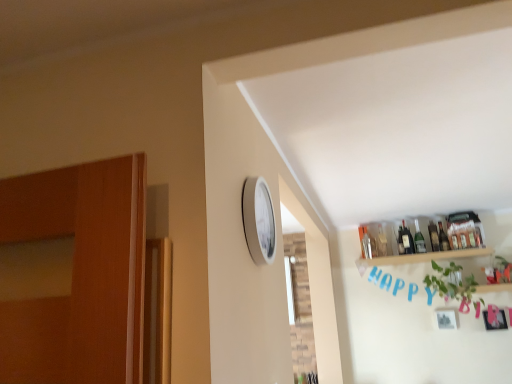
Question: Is translucent glass bottle at upper right, the 1th bottle in the left-to-right sequence, to the left of green leafy plant at upper right from the viewer's perspective?

Choices:
 (A) no
 (B) yes

Answer: (B)

Question: From a real-world perspective, is translucent glass bottle at upper right, which ranks as the 4th bottle in right-to-left order, below green leafy plant at upper right?

Choices:
 (A) yes
 (B) no

Answer: (B)

Question: Is green leafy plant at upper right a part of translucent glass bottle at upper right, which ranks as the 4th bottle in right-to-left order?

Choices:
 (A) no
 (B) yes

Answer: (A)

Question: Is the depth of translucent glass bottle at upper right, which ranks as the 4th bottle in right-to-left order, greater than that of green leafy plant at upper right?

Choices:
 (A) yes
 (B) no

Answer: (A)

Question: From the image's perspective, would you say translucent glass bottle at upper right, which ranks as the 4th bottle in right-to-left order, is positioned over green leafy plant at upper right?

Choices:
 (A) no
 (B) yes

Answer: (B)

Question: Considering the positions of green leafy plant at upper right and translucent glass bottle at upper right, which ranks as the 4th bottle in right-to-left order, in the image, is green leafy plant at upper right bigger or smaller than translucent glass bottle at upper right, which ranks as the 4th bottle in right-to-left order,?

Choices:
 (A) small
 (B) big

Answer: (B)

Question: Would you say green leafy plant at upper right is to the left or to the right of translucent glass bottle at upper right, which ranks as the 4th bottle in right-to-left order, in the picture?

Choices:
 (A) right
 (B) left

Answer: (A)

Question: Is point (455, 281) closer or farther from the camera than point (410, 243)?

Choices:
 (A) farther
 (B) closer

Answer: (B)

Question: Is green leafy plant at upper right spatially inside translucent glass bottle at upper right, the 1th bottle in the left-to-right sequence, or outside of it?

Choices:
 (A) outside
 (B) inside

Answer: (A)

Question: Relative to green leafy plant at upper right, is translucent glass bottle at upper right, which is counted as the fourth bottle, starting from the left, in front or behind?

Choices:
 (A) behind
 (B) front

Answer: (A)

Question: Based on their sizes in the image, would you say translucent glass bottle at upper right, which is counted as the fourth bottle, starting from the left, is bigger or smaller than green leafy plant at upper right?

Choices:
 (A) small
 (B) big

Answer: (A)

Question: Is point (438, 221) closer or farther from the camera than point (428, 281)?

Choices:
 (A) farther
 (B) closer

Answer: (A)

Question: From their relative heights in the image, would you say translucent glass bottle at upper right, marked as the first bottle in a right-to-left arrangement, is taller or shorter than green leafy plant at upper right?

Choices:
 (A) tall
 (B) short

Answer: (B)

Question: Is translucent glass bottle at upper right, which ranks as the 4th bottle in right-to-left order, situated inside wooden shelf at upper right or outside?

Choices:
 (A) inside
 (B) outside

Answer: (B)

Question: From the image's perspective, relative to wooden shelf at upper right, is translucent glass bottle at upper right, the 1th bottle in the left-to-right sequence, above or below?

Choices:
 (A) above
 (B) below

Answer: (A)